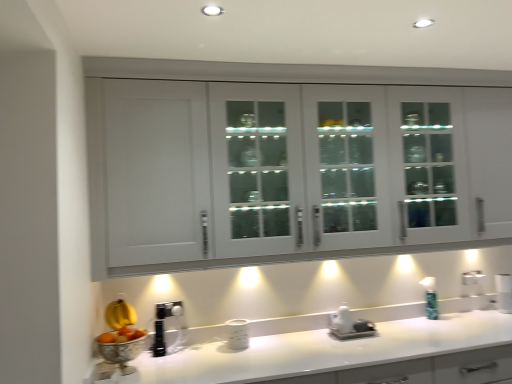
Question: Can you confirm if white glossy countertop at lower center is wider than white glossy cabinet at upper center?

Choices:
 (A) yes
 (B) no

Answer: (A)

Question: Considering the relative sizes of white glossy countertop at lower center and white glossy cabinet at upper center in the image provided, is white glossy countertop at lower center taller than white glossy cabinet at upper center?

Choices:
 (A) no
 (B) yes

Answer: (A)

Question: Could you tell me if white glossy countertop at lower center is turned towards white glossy cabinet at upper center?

Choices:
 (A) no
 (B) yes

Answer: (A)

Question: Considering the relative sizes of white glossy countertop at lower center and white glossy cabinet at upper center in the image provided, is white glossy countertop at lower center thinner than white glossy cabinet at upper center?

Choices:
 (A) yes
 (B) no

Answer: (B)

Question: Considering the relative positions of white glossy countertop at lower center and white glossy cabinet at upper center in the image provided, is white glossy countertop at lower center to the right of white glossy cabinet at upper center from the viewer's perspective?

Choices:
 (A) yes
 (B) no

Answer: (A)

Question: Is white glossy countertop at lower center not within white glossy cabinet at upper center?

Choices:
 (A) no
 (B) yes

Answer: (B)

Question: Considering the relative positions of white glossy cabinet at upper center and green glass soap dispenser at right in the image provided, is white glossy cabinet at upper center to the left of green glass soap dispenser at right from the viewer's perspective?

Choices:
 (A) no
 (B) yes

Answer: (B)

Question: From a real-world perspective, is white glossy cabinet at upper center under green glass soap dispenser at right?

Choices:
 (A) yes
 (B) no

Answer: (B)

Question: From the image's perspective, does white glossy cabinet at upper center appear higher than green glass soap dispenser at right?

Choices:
 (A) yes
 (B) no

Answer: (A)

Question: Is the position of white glossy cabinet at upper center more distant than that of green glass soap dispenser at right?

Choices:
 (A) no
 (B) yes

Answer: (A)

Question: From the image's perspective, would you say white glossy cabinet at upper center is shown under green glass soap dispenser at right?

Choices:
 (A) yes
 (B) no

Answer: (B)

Question: Is white glossy cabinet at upper center turned away from green glass soap dispenser at right?

Choices:
 (A) no
 (B) yes

Answer: (A)

Question: Would you consider white glossy countertop at lower center to be distant from green glass soap dispenser at right?

Choices:
 (A) yes
 (B) no

Answer: (B)